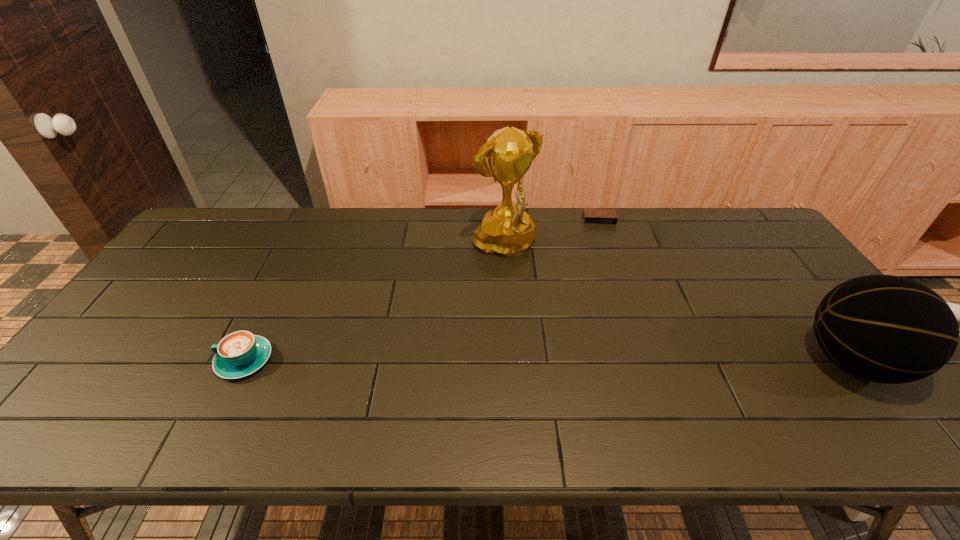
Point out which object is positioned as the second nearest to the third object from left to right. Please provide its 2D coordinates. Your answer should be formatted as a tuple, i.e. [(x, y)], where the tuple contains the x and y coordinates of a point satisfying the conditions above.

[(888, 329)]

This screenshot has height=540, width=960. I want to click on object that stands as the second closest to the second shortest object, so click(590, 215).